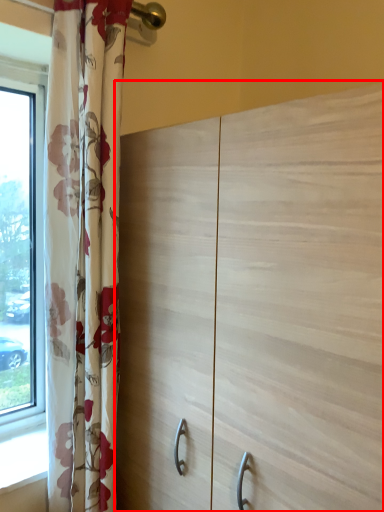
Question: From the image's perspective, considering the relative positions of cupboard (annotated by the red box) and curtain in the image provided, where is cupboard (annotated by the red box) located with respect to the staircase?

Choices:
 (A) below
 (B) above

Answer: (A)